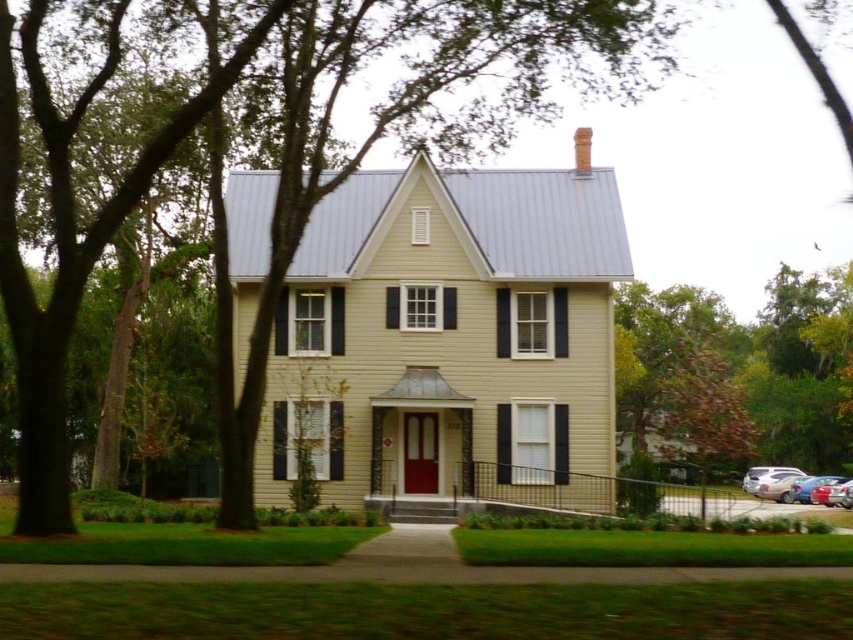
Who is more forward, (787,486) or (827,483)?

Point (827,483)

The height and width of the screenshot is (640, 853). What do you see at coordinates (776, 483) in the screenshot? I see `metallic silver sedan at lower right` at bounding box center [776, 483].

The height and width of the screenshot is (640, 853). Describe the element at coordinates (776, 483) in the screenshot. I see `metallic silver sedan at lower right` at that location.

The height and width of the screenshot is (640, 853). Identify the location of metallic silver sedan at lower right. (776, 483).

Which is in front, point (221, 156) or point (788, 472)?

Positioned in front is point (221, 156).

Can you confirm if green leafy tree at center is positioned to the right of metallic silver sedan at lower right?

In fact, green leafy tree at center is to the left of metallic silver sedan at lower right.

Identify the location of green leafy tree at center. Image resolution: width=853 pixels, height=640 pixels. (117, 225).

Identify the location of green leafy tree at center. 117,225.

Does green leafy tree at center lie behind metallic red sedan at lower right?

That is False.

How distant is green leafy tree at center from metallic red sedan at lower right?

A distance of 42.78 meters exists between green leafy tree at center and metallic red sedan at lower right.

Locate an element on the screen. green leafy tree at center is located at coordinates (117, 225).

At what (x,y) coordinates should I click in order to perform the action: click on green leafy tree at center. Please return your answer as a coordinate pair (x, y). This screenshot has width=853, height=640. Looking at the image, I should click on 117,225.